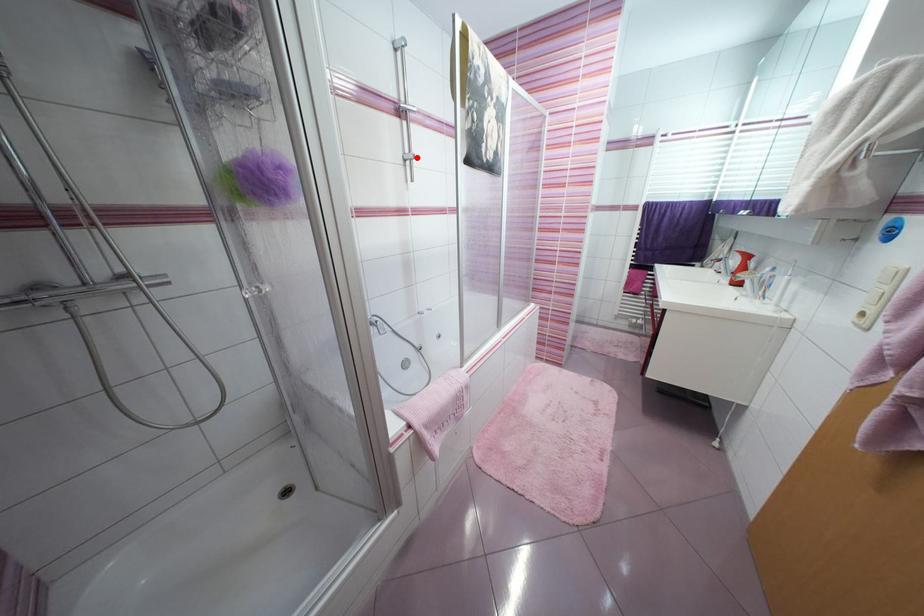
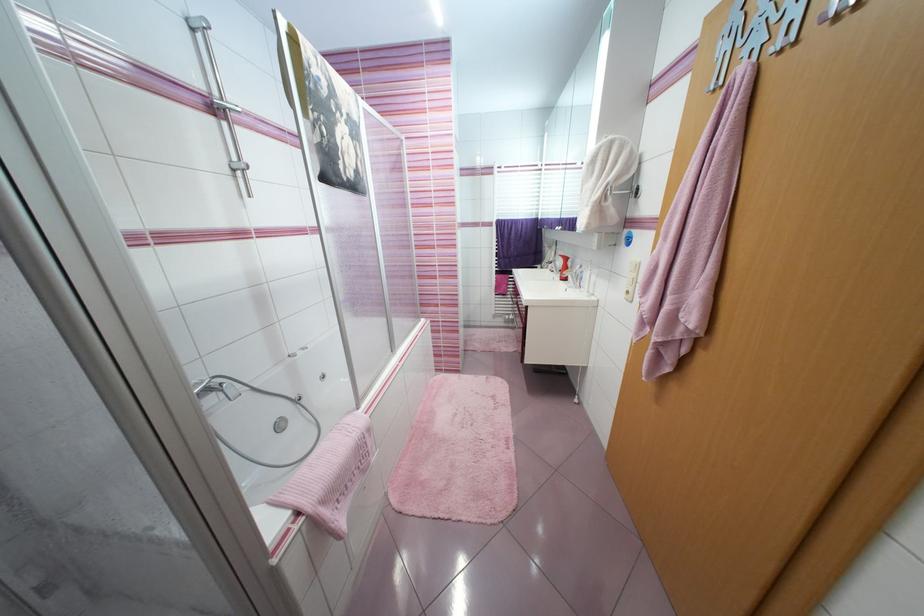
Locate, in the second image, the point that corresponds to the highlighted location in the first image.

(249, 167)